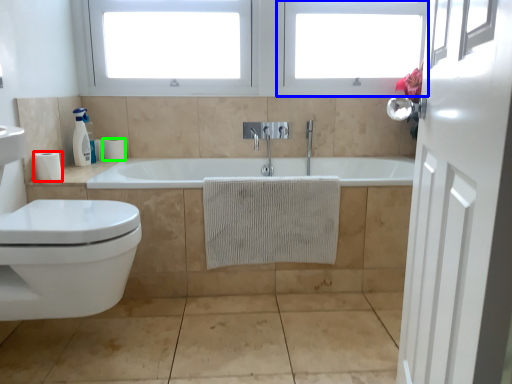
Question: Which object is the farthest from toilet paper (highlighted by a red box)? Choose among these: window frame (highlighted by a blue box) or toilet paper (highlighted by a green box).

Choices:
 (A) window frame
 (B) toilet paper

Answer: (A)